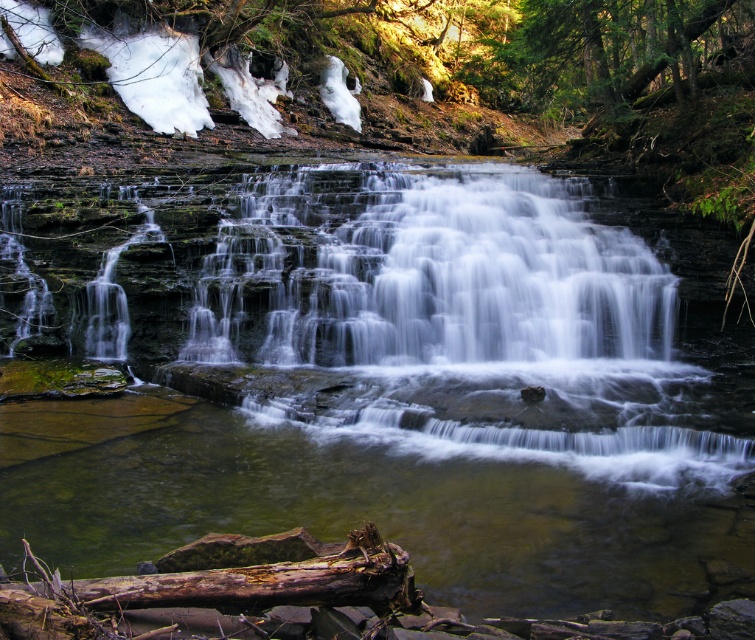
Question: Which of the following is the closest to the observer?

Choices:
 (A) (225, 516)
 (B) (236, 576)

Answer: (B)

Question: From the image, what is the correct spatial relationship of clear water at center in relation to rusty wood log at lower center?

Choices:
 (A) left
 (B) right

Answer: (B)

Question: Does clear water at center have a smaller size compared to rusty wood log at lower center?

Choices:
 (A) yes
 (B) no

Answer: (B)

Question: Which object is closer to the camera taking this photo?

Choices:
 (A) rusty wood log at lower center
 (B) clear water at center

Answer: (A)

Question: Is clear water at center closer to the viewer compared to rusty wood log at lower center?

Choices:
 (A) no
 (B) yes

Answer: (A)

Question: Which of the following is the farthest from the observer?

Choices:
 (A) clear water at center
 (B) rusty wood log at lower center

Answer: (A)